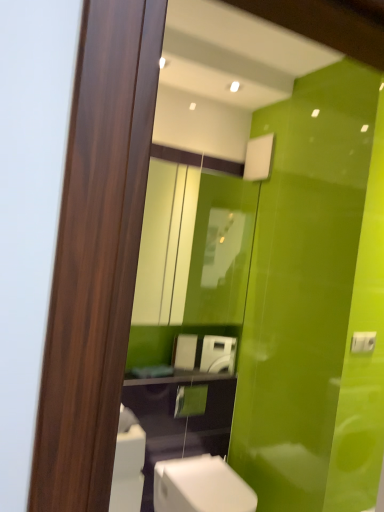
Question: From a real-world perspective, is matte glass mirror at upper center physically located above or below white glossy toilet at lower center?

Choices:
 (A) below
 (B) above

Answer: (B)

Question: Do you think matte glass mirror at upper center is within white glossy toilet at lower center, or outside of it?

Choices:
 (A) inside
 (B) outside

Answer: (B)

Question: Estimate the real-world distances between objects in this image. Which object is closer to the matte glass mirror at upper center?

Choices:
 (A) white glossy washing machine at center
 (B) white glossy toilet at lower center

Answer: (A)

Question: Which is nearer to the white glossy toilet at lower center?

Choices:
 (A) white glossy washing machine at center
 (B) matte glass mirror at upper center

Answer: (A)